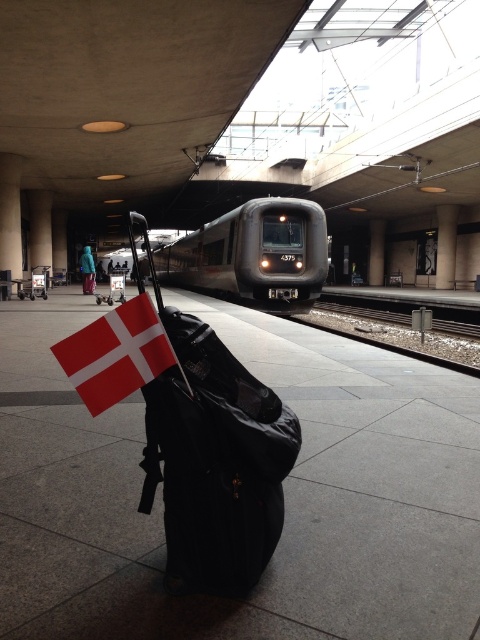
Question: Does matte black suitcase at center appear on the left side of red fabric flag at center?

Choices:
 (A) no
 (B) yes

Answer: (A)

Question: Which point appears closest to the camera in this image?

Choices:
 (A) (226, 410)
 (B) (292, 225)

Answer: (A)

Question: Which point is closer to the camera taking this photo?

Choices:
 (A) (347, 307)
 (B) (137, 376)
 (C) (289, 282)
 (D) (170, 548)

Answer: (B)

Question: Is red fabric flag at center smaller than black metal train track at center?

Choices:
 (A) yes
 (B) no

Answer: (A)

Question: Does red fabric flag at center have a larger size compared to black metal train track at center?

Choices:
 (A) no
 (B) yes

Answer: (A)

Question: Which object is the closest to the matte black suitcase at center?

Choices:
 (A) black metal train track at center
 (B) metallic gray train at center

Answer: (A)